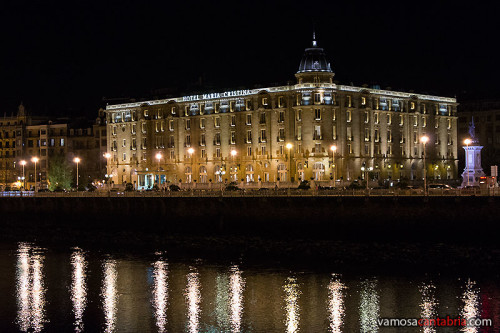
In order to click on door entrance in this screenshot , I will do `click(152, 179)`.